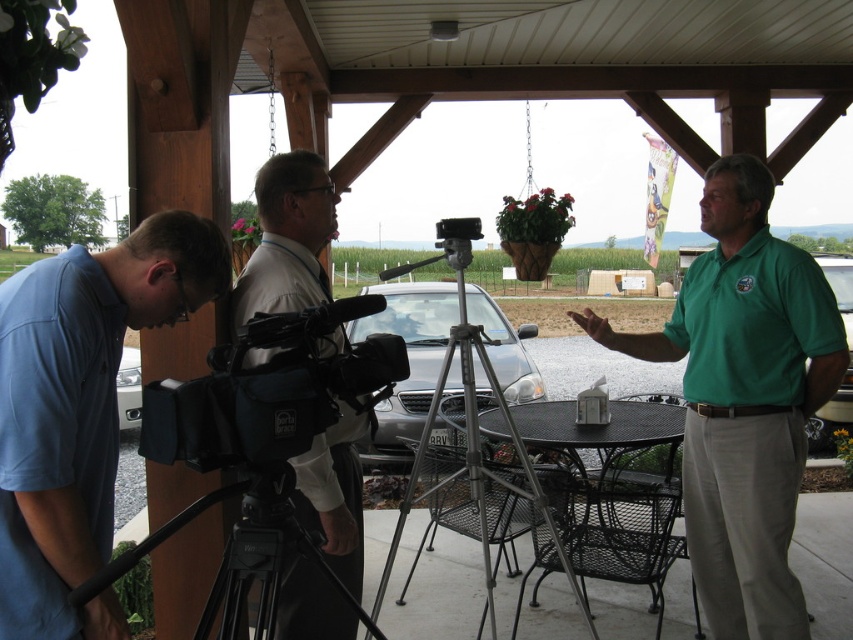
You are a camera operator who needs to adjust the camera position. Based on the scene, where is the black fabric video camera at center relative to the metallic tripod at center?

The black fabric video camera at center is positioned on the left side of the metallic tripod at center.

You are standing at the point marked as point (x=80, y=410) in the image. What is the nearest object to you?

The nearest object to you is the blue cotton shirt at lower left, as the point (x=80, y=410) is located on it.